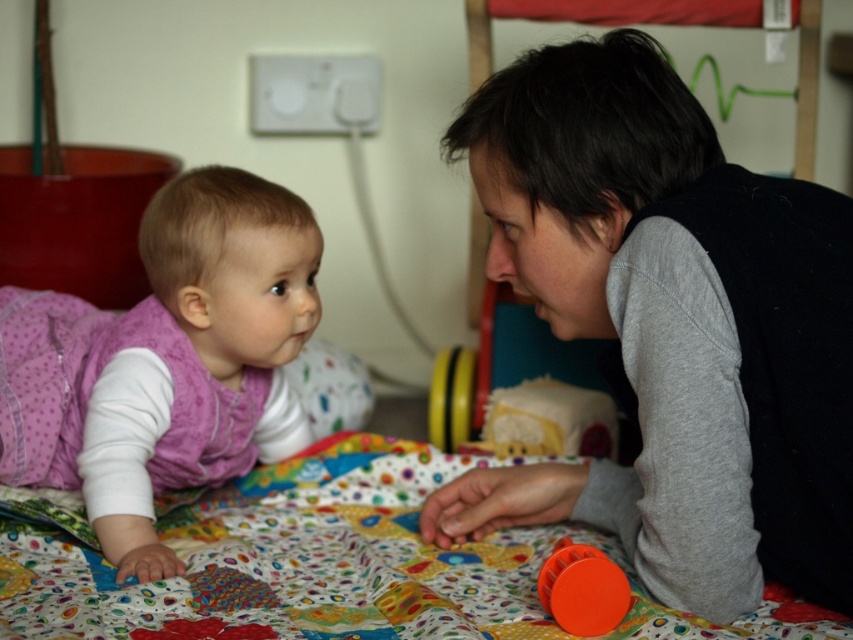
You are a photographer trying to capture the baby and the adult in the scene. The polka dot fabric quilt at center is represented by point (x=326, y=564). Where should you position your camera to ensure both the baby and the adult are in focus?

The polka dot fabric quilt at center is represented by point (x=326, y=564). To ensure both the baby and the adult are in focus, position the camera so the focal point is on the quilt at the center point (x=326, y=564). This central point will keep both subjects sharp as they are likely positioned around this area.

You are standing in the room and see two points marked in the image. Which point, point (694, 522) or point (132, 500), is closer to you?

Point (694, 522) is closer to the viewer than point (132, 500).

You are holding a toy that is 12 inches long and want to place it between you and the point at coordinates point (x=822, y=440). Is there enough space to place the toy without it overlapping with anything?

The distance between you and the point (x=822, y=440) is 30.71 inches, so there is enough space to place the 12 inch toy without overlapping anything.